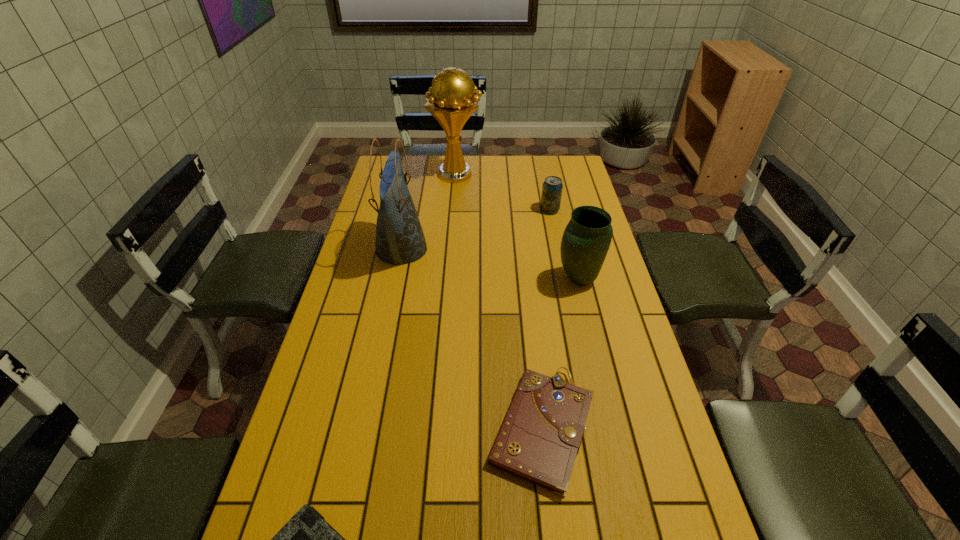
In order to click on vacant space situated 0.080m on the front of the pop soda in this screenshot , I will do `click(553, 228)`.

The image size is (960, 540). In order to click on free point located 0.310m on the left of the fifth farthest object in this screenshot , I will do `click(359, 428)`.

At what (x,y) coordinates should I click in order to perform the action: click on object located at the far edge. Please return your answer as a coordinate pair (x, y). Looking at the image, I should click on 452,102.

Find the location of a particular element. The width and height of the screenshot is (960, 540). object that is at the left edge is located at coordinates (400, 239).

Locate an element on the screen. The height and width of the screenshot is (540, 960). vase located in the right edge section of the desktop is located at coordinates (587, 237).

The height and width of the screenshot is (540, 960). What are the coordinates of `pop soda that is at the right edge` in the screenshot? It's located at (552, 187).

Where is `notebook that is at the right edge`? notebook that is at the right edge is located at coordinates (539, 439).

I want to click on free region at the far edge of the desktop, so click(x=509, y=164).

This screenshot has height=540, width=960. I want to click on free location at the left edge of the desktop, so click(x=362, y=278).

Where is `free space at the right edge of the desktop`? free space at the right edge of the desktop is located at coordinates (636, 450).